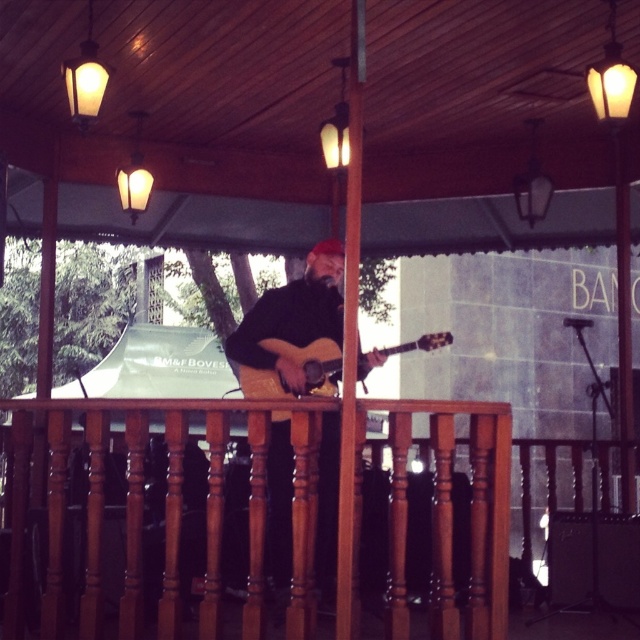
You are standing on the stage and looking at two points marked on the stage floor. The first point is at coordinates point (298, 515) and the second point is at point (284, 452). Which point is closer to you?

Point (298, 515) is closer to the viewer than point (284, 452).

You are standing on the stage where the musician is performing. You want to place a small decorative plant pot exactly at the point marked by the coordinates point (168, 506). What object will the plant pot be placed on?

The point (168, 506) corresponds to the brown polished wood railing at center, so the plant pot will be placed on the brown polished wood railing at center.

Based on the photo, you are a stagehand preparing to place a new microphone stand at point (168,506). Based on the scene description, what object is located at this coordinate?

The point (168,506) indicates the location of the brown polished wood railing at center.